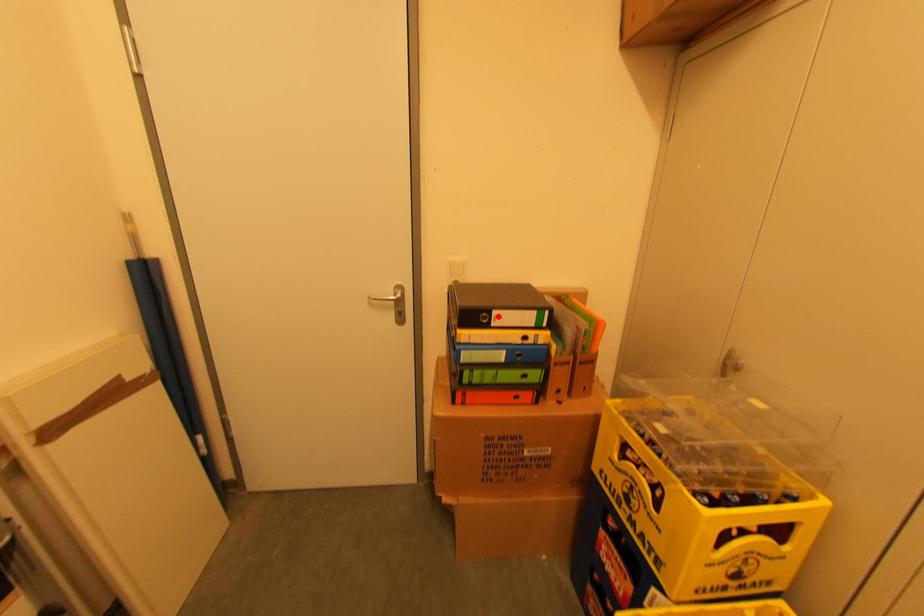
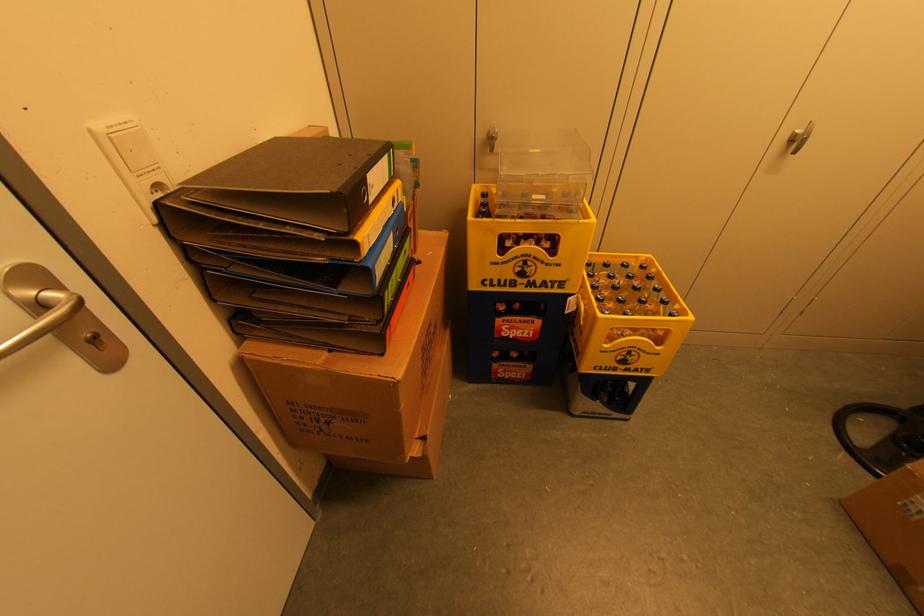
Question: I am providing you with two images of the same scene from different viewpoints. Image1 has a red point marked. In image2, the corresponding 3D location appears at what relative position? Reply with the corresponding letter.

Choices:
 (A) Closer
 (B) Farther

Answer: (A)